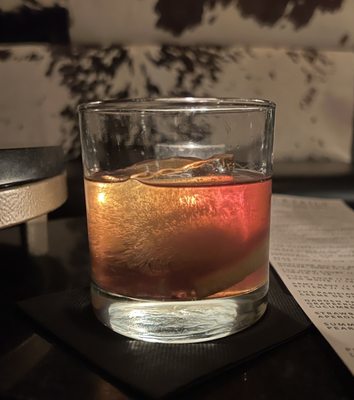
Locate an element on the screen. lowball glass is located at coordinates (227, 136).